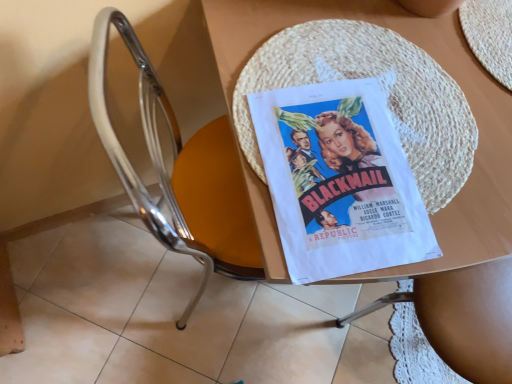
Identify the location of vacant space situated above white paper poster at center (from a real-world perspective). Image resolution: width=512 pixels, height=384 pixels. (340, 173).